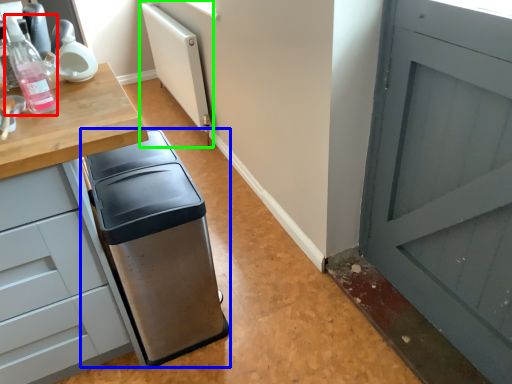
Question: Which object is the closest to the bottle (highlighted by a red box)? Choose among these: waste container (highlighted by a blue box) or radiator (highlighted by a green box).

Choices:
 (A) waste container
 (B) radiator

Answer: (A)